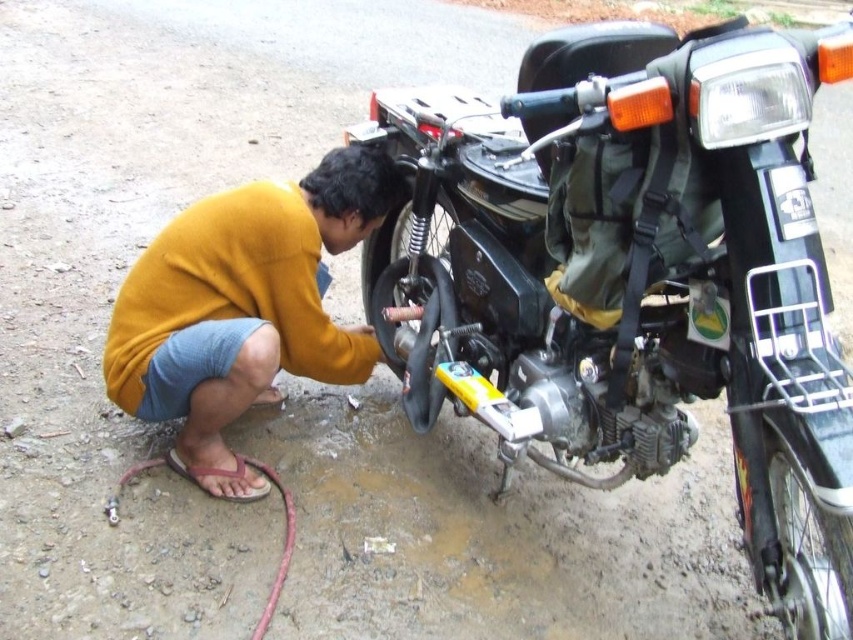
Question: Which object appears closest to the camera in this image?

Choices:
 (A) black matte motorcycle at center
 (B) black rubber tire at center

Answer: (A)

Question: Which object is positioned farthest from the black matte motorcycle at center?

Choices:
 (A) yellow matte shirt at lower left
 (B) black rubber tire at center

Answer: (A)

Question: Is black matte motorcycle at center thinner than black rubber tire at center?

Choices:
 (A) yes
 (B) no

Answer: (B)

Question: Which of the following is the farthest from the observer?

Choices:
 (A) pos(415,209)
 (B) pos(376,337)
 (C) pos(181,388)

Answer: (B)

Question: Observing the image, what is the correct spatial positioning of yellow matte shirt at lower left in reference to black rubber tire at center?

Choices:
 (A) above
 (B) below

Answer: (B)

Question: Does black matte motorcycle at center lie behind yellow matte shirt at lower left?

Choices:
 (A) no
 (B) yes

Answer: (A)